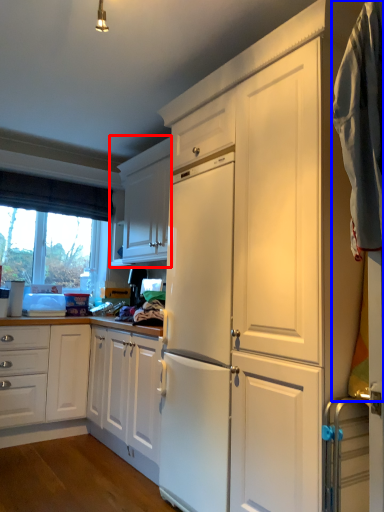
Question: Which of the following is the closest to the observer, cabinetry (highlighted by a red box) or laundry (highlighted by a blue box)?

Choices:
 (A) cabinetry
 (B) laundry

Answer: (B)